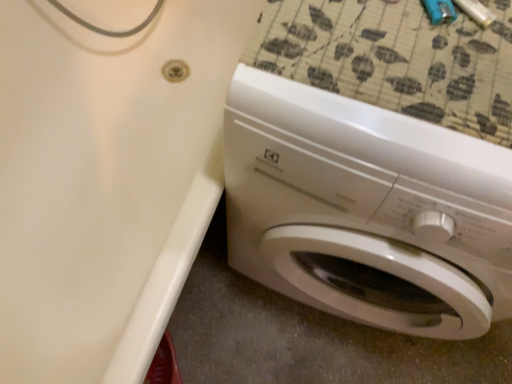
Locate an element on the screen. The image size is (512, 384). white glossy washing machine at lower right is located at coordinates (366, 210).

The height and width of the screenshot is (384, 512). Describe the element at coordinates (366, 210) in the screenshot. I see `white glossy washing machine at lower right` at that location.

Find the location of a particular element. This screenshot has height=384, width=512. white glossy bathtub at lower right is located at coordinates (106, 181).

What do you see at coordinates (106, 181) in the screenshot? I see `white glossy bathtub at lower right` at bounding box center [106, 181].

Where is `white glossy washing machine at lower right`? Image resolution: width=512 pixels, height=384 pixels. white glossy washing machine at lower right is located at coordinates (366, 210).

Which is more to the left, white glossy bathtub at lower right or white glossy washing machine at lower right?

Positioned to the left is white glossy bathtub at lower right.

Does white glossy bathtub at lower right lie behind white glossy washing machine at lower right?

Yes, white glossy bathtub at lower right is behind white glossy washing machine at lower right.

Does point (90, 258) lie behind point (319, 156)?

Yes.

From the image's perspective, between white glossy bathtub at lower right and white glossy washing machine at lower right, who is located below?

white glossy washing machine at lower right is shown below in the image.

From a real-world perspective, who is located lower, white glossy bathtub at lower right or white glossy washing machine at lower right?

In real-world perspective, white glossy bathtub at lower right is lower.

Which of these two, white glossy bathtub at lower right or white glossy washing machine at lower right, is wider?

Wider between the two is white glossy bathtub at lower right.

Who is taller, white glossy bathtub at lower right or white glossy washing machine at lower right?

Standing taller between the two is white glossy washing machine at lower right.

From the picture: Considering the sizes of white glossy bathtub at lower right and white glossy washing machine at lower right in the image, is white glossy bathtub at lower right bigger or smaller than white glossy washing machine at lower right?

Considering their sizes, white glossy bathtub at lower right takes up more space than white glossy washing machine at lower right.

Is white glossy bathtub at lower right completely or partially outside of white glossy washing machine at lower right?

That's correct, white glossy bathtub at lower right is outside of white glossy washing machine at lower right.

Looking at this image, can you see white glossy bathtub at lower right touching white glossy washing machine at lower right?

No.

Is white glossy bathtub at lower right turned away from white glossy washing machine at lower right?

No, white glossy bathtub at lower right's orientation is not away from white glossy washing machine at lower right.

The width and height of the screenshot is (512, 384). Identify the location of bath that is behind the white glossy washing machine at lower right. (106, 181).

Which is more to the left, white glossy washing machine at lower right or white glossy bathtub at lower right?

Positioned to the left is white glossy bathtub at lower right.

Considering the relative positions of white glossy washing machine at lower right and white glossy bathtub at lower right in the image provided, is white glossy washing machine at lower right in front of white glossy bathtub at lower right?

Yes, white glossy washing machine at lower right is closer to the camera.

Between point (343, 124) and point (155, 155), which one is positioned behind?

The point (155, 155) is farther.

From the image's perspective, which one is positioned higher, white glossy washing machine at lower right or white glossy bathtub at lower right?

white glossy bathtub at lower right is shown above in the image.

From a real-world perspective, relative to white glossy bathtub at lower right, is white glossy washing machine at lower right vertically above or below?

white glossy washing machine at lower right is situated higher than white glossy bathtub at lower right in the real world.

Considering the sizes of objects white glossy washing machine at lower right and white glossy bathtub at lower right in the image provided, who is wider, white glossy washing machine at lower right or white glossy bathtub at lower right?

white glossy bathtub at lower right is wider.

Can you confirm if white glossy washing machine at lower right is shorter than white glossy bathtub at lower right?

Incorrect, the height of white glossy washing machine at lower right does not fall short of that of white glossy bathtub at lower right.

Based on their sizes in the image, would you say white glossy washing machine at lower right is bigger or smaller than white glossy bathtub at lower right?

Considering their sizes, white glossy washing machine at lower right takes up less space than white glossy bathtub at lower right.

Is white glossy washing machine at lower right located outside white glossy bathtub at lower right?

Yes, white glossy washing machine at lower right is not within white glossy bathtub at lower right.

Are white glossy washing machine at lower right and white glossy bathtub at lower right making contact?

No, white glossy washing machine at lower right is not making contact with white glossy bathtub at lower right.

Could you tell me if white glossy washing machine at lower right is turned towards white glossy bathtub at lower right?

No, white glossy washing machine at lower right is not oriented towards white glossy bathtub at lower right.

Locate an element on the screen. This screenshot has height=384, width=512. bath that appears behind the white glossy washing machine at lower right is located at coordinates (106, 181).

You are a GUI agent. You are given a task and a screenshot of the screen. Output one action in this format:
    pyautogui.click(x=<x>, y=<y>)
    Task: Click on the washing machine that appears below the white glossy bathtub at lower right (from the image's perspective)
    
    Given the screenshot: What is the action you would take?
    pyautogui.click(x=366, y=210)

You are a GUI agent. You are given a task and a screenshot of the screen. Output one action in this format:
    pyautogui.click(x=<x>, y=<y>)
    Task: Click on the bath on the left of white glossy washing machine at lower right
    This screenshot has width=512, height=384.
    Given the screenshot: What is the action you would take?
    (x=106, y=181)